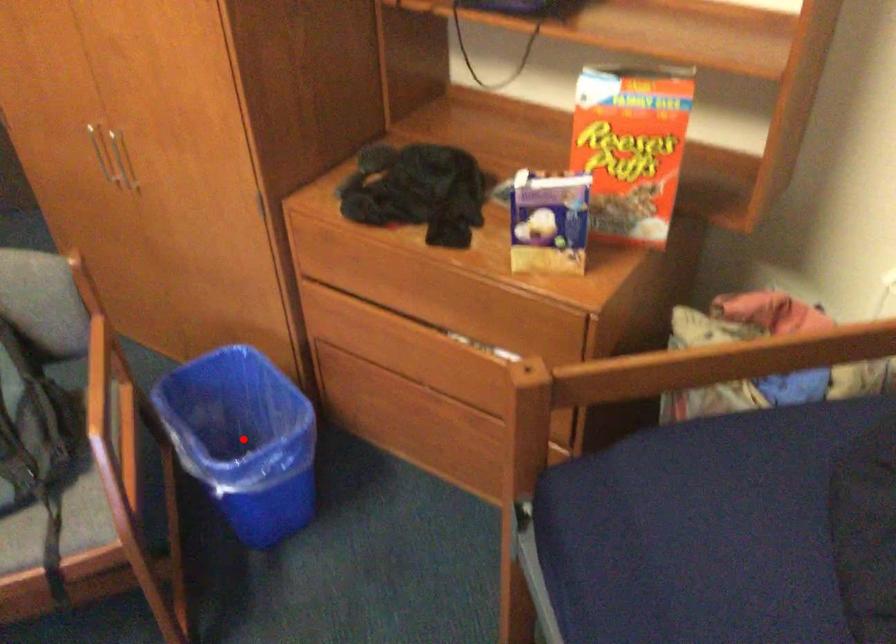
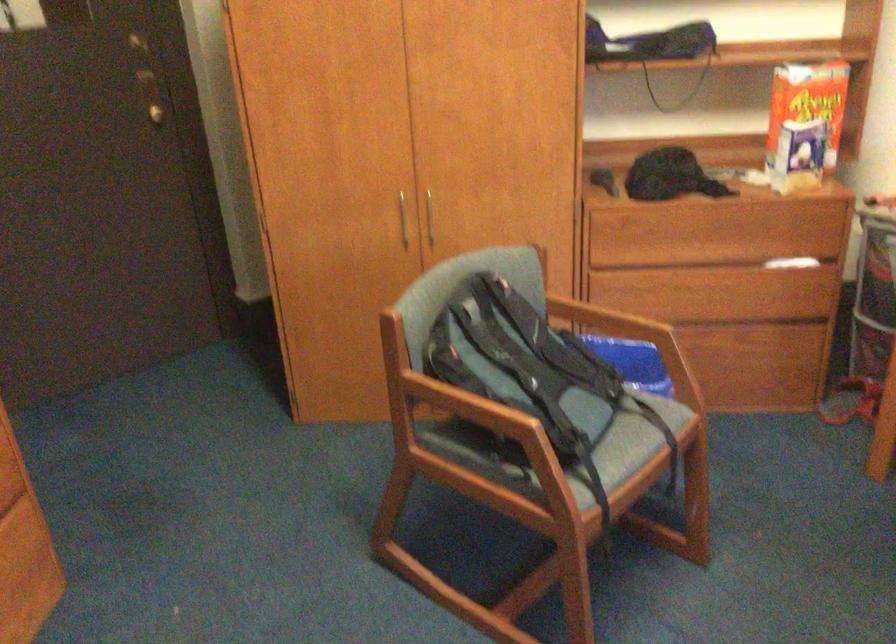
Question: I am providing you with two images of the same scene from different viewpoints. A red point is marked on the first image. Is the red point's position out of view in image 2?

Choices:
 (A) Yes
 (B) No

Answer: (A)